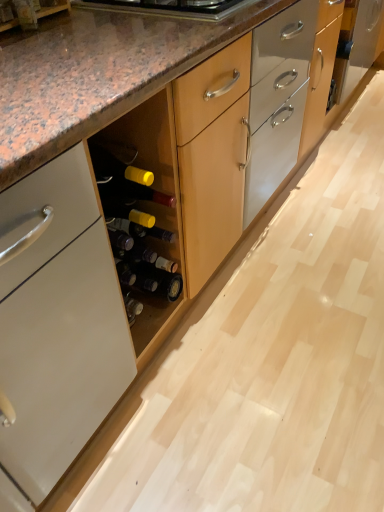
Question: Does wooden drawer at center come in front of matte brown wood at lower left?

Choices:
 (A) no
 (B) yes

Answer: (A)

Question: Does wooden drawer at center turn towards matte brown wood at lower left?

Choices:
 (A) yes
 (B) no

Answer: (B)

Question: Is wooden drawer at center positioned with its back to matte brown wood at lower left?

Choices:
 (A) no
 (B) yes

Answer: (A)

Question: Are wooden drawer at center and matte brown wood at lower left far apart?

Choices:
 (A) no
 (B) yes

Answer: (B)

Question: Is matte brown wood at lower left a part of wooden drawer at center?

Choices:
 (A) yes
 (B) no

Answer: (B)

Question: Considering the relative sizes of wooden drawer at center and matte brown wood at lower left in the image provided, is wooden drawer at center shorter than matte brown wood at lower left?

Choices:
 (A) no
 (B) yes

Answer: (A)

Question: Considering the relative positions of matte yellow glass wine bottle at center and matte brown wood at lower left in the image provided, is matte yellow glass wine bottle at center to the left of matte brown wood at lower left from the viewer's perspective?

Choices:
 (A) yes
 (B) no

Answer: (B)

Question: Is matte yellow glass wine bottle at center smaller than matte brown wood at lower left?

Choices:
 (A) no
 (B) yes

Answer: (A)

Question: From a real-world perspective, is matte yellow glass wine bottle at center under matte brown wood at lower left?

Choices:
 (A) yes
 (B) no

Answer: (A)

Question: Is matte yellow glass wine bottle at center outside matte brown wood at lower left?

Choices:
 (A) yes
 (B) no

Answer: (A)

Question: From the image's perspective, is matte yellow glass wine bottle at center over matte brown wood at lower left?

Choices:
 (A) no
 (B) yes

Answer: (A)

Question: Considering the relative sizes of matte yellow glass wine bottle at center and matte brown wood at lower left in the image provided, is matte yellow glass wine bottle at center shorter than matte brown wood at lower left?

Choices:
 (A) no
 (B) yes

Answer: (B)

Question: Is wooden drawer at center further to camera compared to matte black bottle at center, the 2th beer bottle viewed from the top?

Choices:
 (A) no
 (B) yes

Answer: (B)